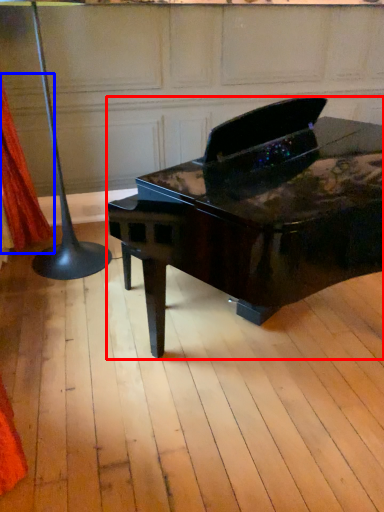
Question: Which of the following is the farthest to the observer, piano (highlighted by a red box) or curtain (highlighted by a blue box)?

Choices:
 (A) piano
 (B) curtain

Answer: (B)